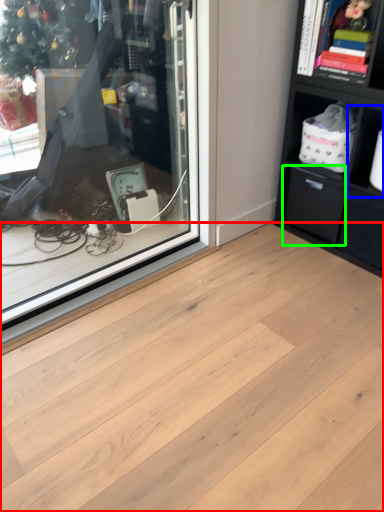
Question: Which object is the farthest from plank (highlighted by a red box)? Choose among these: cabinet (highlighted by a blue box) or drawer (highlighted by a green box).

Choices:
 (A) cabinet
 (B) drawer

Answer: (A)